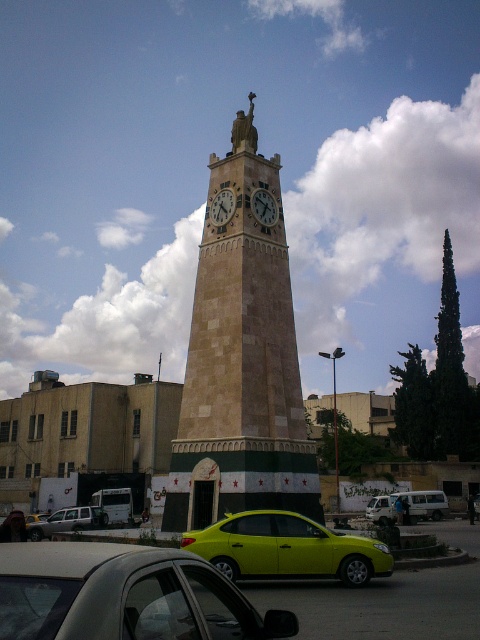
Question: Can you confirm if metallic silver van at lower center is thinner than stone clock at center?

Choices:
 (A) yes
 (B) no

Answer: (B)

Question: Is neon yellow car at center below wooden clock face at center?

Choices:
 (A) yes
 (B) no

Answer: (A)

Question: Considering the real-world distances, which object is closest to the matte gray car at lower left?

Choices:
 (A) metallic silver van at lower center
 (B) wooden clock face at center

Answer: (A)

Question: Estimate the real-world distances between objects in this image. Which object is closer to the metallic silver van at lower left?

Choices:
 (A) neon yellow car at center
 (B) metallic silver van at lower center

Answer: (A)

Question: Can you confirm if neon yellow car at center is positioned above wooden clock face at center?

Choices:
 (A) yes
 (B) no

Answer: (B)

Question: Which object appears farthest from the camera in this image?

Choices:
 (A) wooden clock face at center
 (B) beige stone clock tower at center
 (C) stone clock at center

Answer: (A)